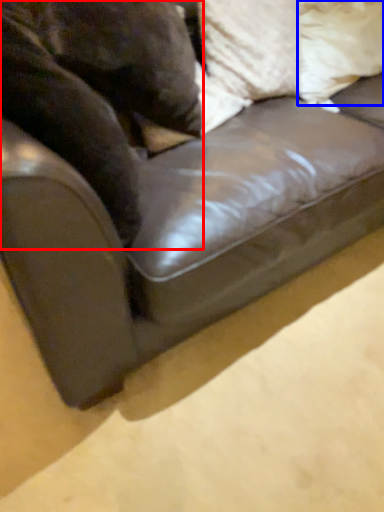
Question: Which point is closer to the camera, animal (highlighted by a red box) or pillow (highlighted by a blue box)?

Choices:
 (A) animal
 (B) pillow

Answer: (A)